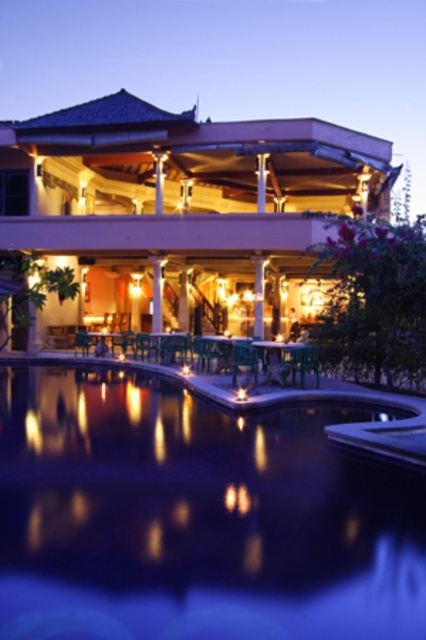
Who is positioned more to the left, green plastic chair at lower center or green plastic chair at center?

Positioned to the left is green plastic chair at center.

Between point (313, 355) and point (245, 365), which one is positioned behind?

Point (245, 365)

Where is `green plastic chair at lower center`? green plastic chair at lower center is located at coordinates (301, 362).

How much distance is there between smooth glass pool at center and green plastic chair at center?

The distance of smooth glass pool at center from green plastic chair at center is 4.69 meters.

Is smooth glass pool at center further to camera compared to green plastic chair at center?

No, it is in front of green plastic chair at center.

The height and width of the screenshot is (640, 426). Find the location of `smooth glass pool at center`. smooth glass pool at center is located at coordinates (195, 516).

The width and height of the screenshot is (426, 640). Identify the location of smooth glass pool at center. (195, 516).

Which is behind, point (20, 536) or point (213, 240)?

Point (213, 240)

Find the location of `smooth glass pool at center`. smooth glass pool at center is located at coordinates (195, 516).